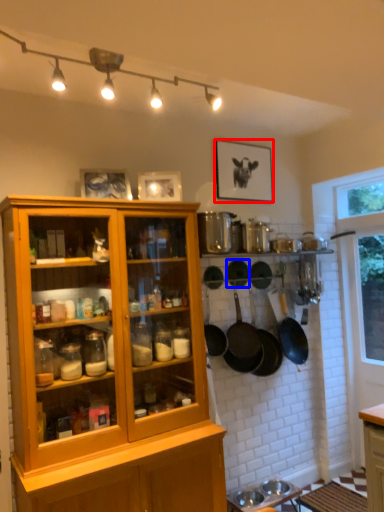
Question: Which object is further to the camera taking this photo, picture frame (highlighted by a red box) or frying pan (highlighted by a blue box)?

Choices:
 (A) picture frame
 (B) frying pan

Answer: (A)